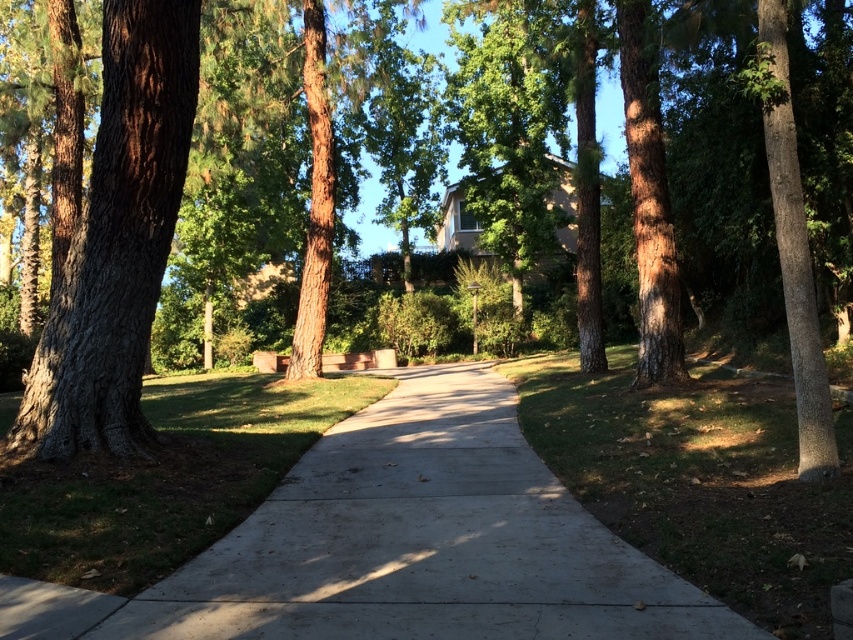
Can you confirm if concrete at center is positioned to the left of smooth brown tree trunk at left?

Incorrect, concrete at center is not on the left side of smooth brown tree trunk at left.

Does concrete at center appear over smooth brown tree trunk at left?

No.

What do you see at coordinates (402, 545) in the screenshot? This screenshot has width=853, height=640. I see `concrete at center` at bounding box center [402, 545].

Where is `concrete at center`? Image resolution: width=853 pixels, height=640 pixels. concrete at center is located at coordinates (402, 545).